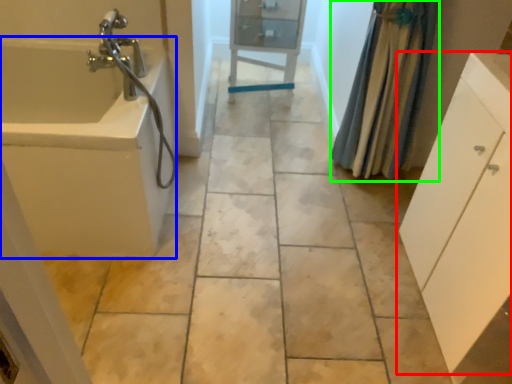
Question: Estimate the real-world distances between objects in this image. Which object is closer to bathroom cabinet (highlighted by a red box), bath (highlighted by a blue box) or shower curtain (highlighted by a green box)?

Choices:
 (A) bath
 (B) shower curtain

Answer: (B)